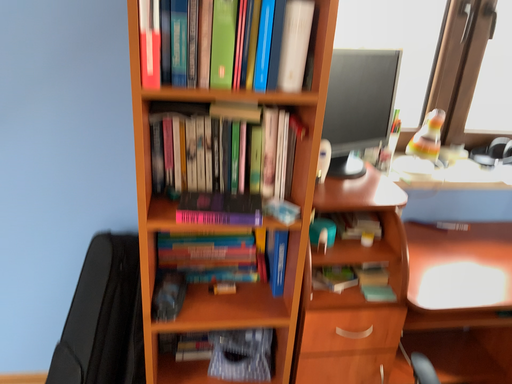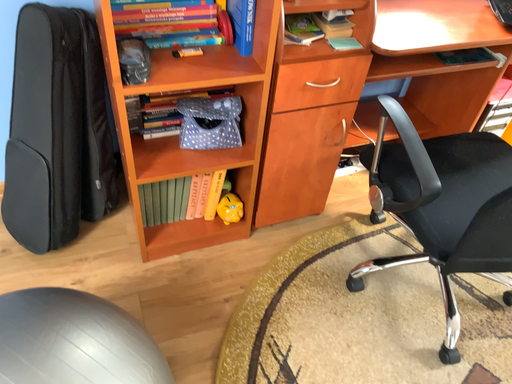
Question: How did the camera likely rotate when shooting the video?

Choices:
 (A) rotated left
 (B) rotated right

Answer: (B)